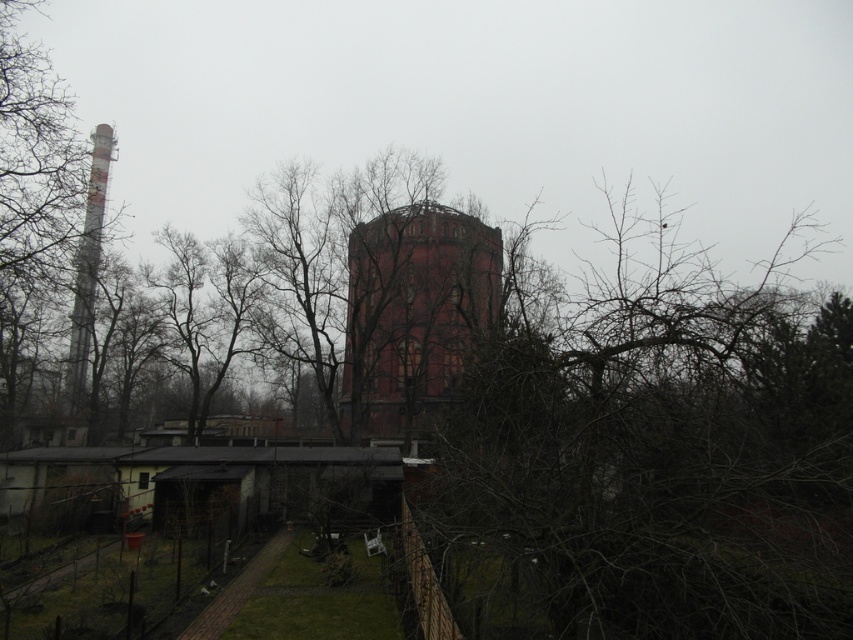
Question: Is smooth gray pipe at left to the right of white-painted metal chimney at left from the viewer's perspective?

Choices:
 (A) yes
 (B) no

Answer: (B)

Question: Is the position of rustic brick tower at center more distant than that of smooth gray pipe at left?

Choices:
 (A) yes
 (B) no

Answer: (A)

Question: Estimate the real-world distances between objects in this image. Which object is farther from the rustic brick tower at center?

Choices:
 (A) smooth gray pipe at left
 (B) bare branches at center

Answer: (A)

Question: Considering the real-world distances, which object is closest to the smooth gray pipe at left?

Choices:
 (A) rustic brick tower at center
 (B) bare branches at center
 (C) white-painted metal chimney at left

Answer: (C)

Question: Where is bare branches at center located in relation to smooth gray pipe at left in the image?

Choices:
 (A) below
 (B) above

Answer: (B)

Question: Which of the following is the closest to the observer?

Choices:
 (A) rustic brick tower at center
 (B) white-painted metal chimney at left
 (C) bare branches at center
 (D) smooth gray pipe at left

Answer: (C)